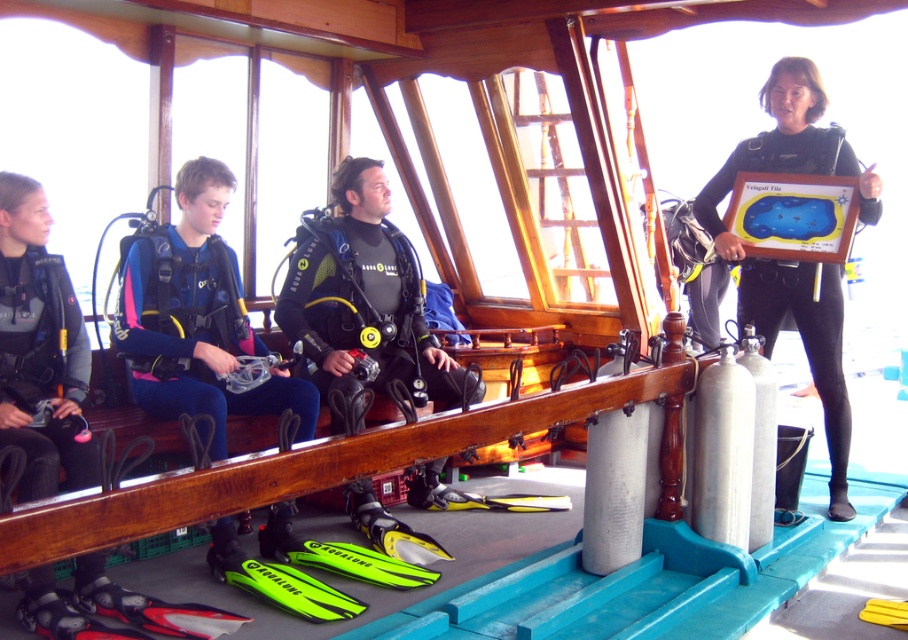
Question: Can you confirm if pink neoprene wetsuit at left is positioned to the right of black matte wetsuit at right?

Choices:
 (A) yes
 (B) no

Answer: (B)

Question: Is matte black wetsuit at left closer to the viewer compared to black matte wetsuit at right?

Choices:
 (A) no
 (B) yes

Answer: (B)

Question: Is pink neoprene wetsuit at left wider than matte black wetsuit at left?

Choices:
 (A) yes
 (B) no

Answer: (A)

Question: Which object appears farthest from the camera in this image?

Choices:
 (A) black matte wetsuit at right
 (B) pink neoprene wetsuit at left
 (C) matte black wetsuit at left

Answer: (A)

Question: Which point is closer to the camera taking this photo?

Choices:
 (A) (835, 340)
 (B) (94, 560)

Answer: (B)

Question: Based on their relative distances, which object is farther from the black matte wetsuit at right?

Choices:
 (A) pink neoprene wetsuit at left
 (B) matte black wetsuit at left

Answer: (B)